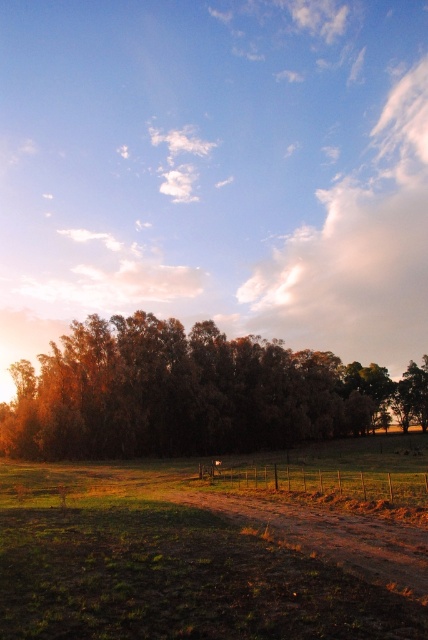
Does brown textured trees at center have a greater height compared to brown dirt track at center?

Yes.

Is brown textured trees at center closer to camera compared to brown dirt track at center?

No, brown textured trees at center is further to the viewer.

Which is in front, point (124, 435) or point (234, 506)?

Point (234, 506)

This screenshot has height=640, width=428. In order to click on brown textured trees at center in this screenshot , I will do `click(187, 394)`.